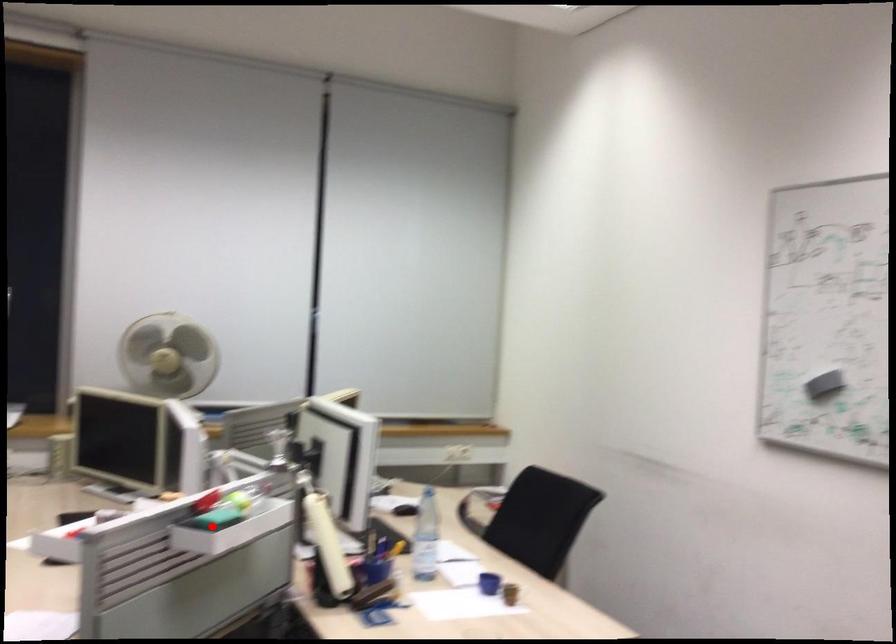
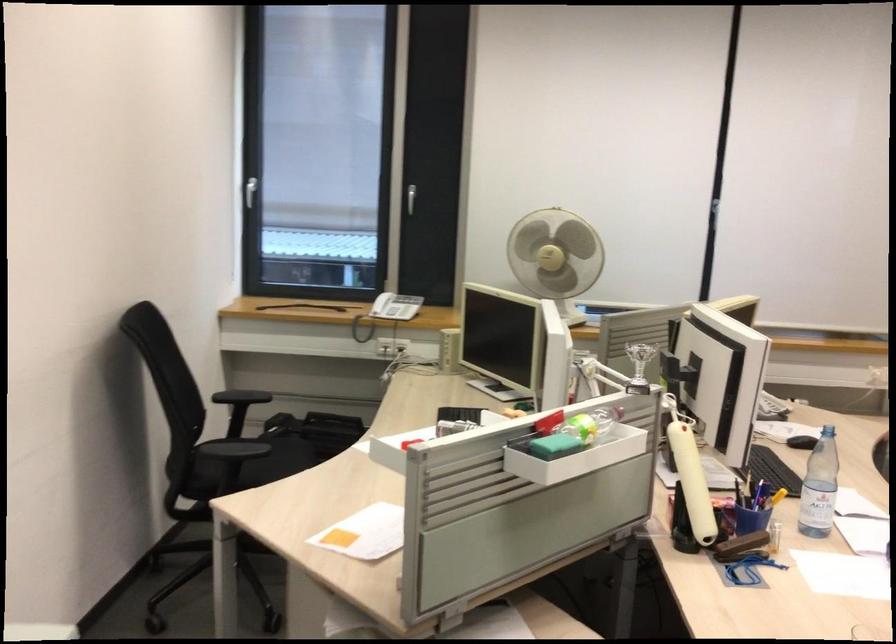
In the second image, find the point that corresponds to the highlighted location in the first image.

(554, 446)